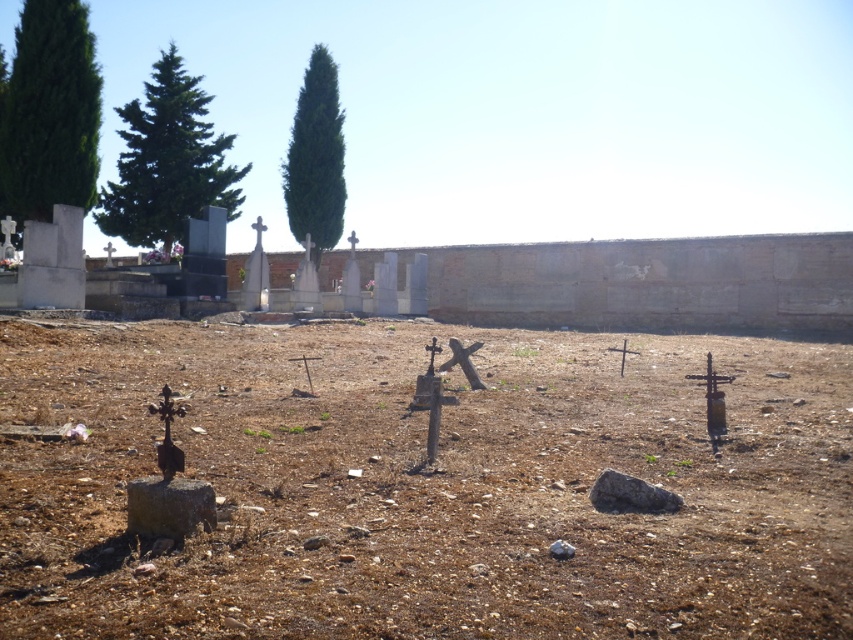
Question: Considering the relative positions of green leafy tree at upper left and green textured tree at center in the image provided, where is green leafy tree at upper left located with respect to green textured tree at center?

Choices:
 (A) below
 (B) above

Answer: (A)

Question: Does brown dirt field at center lie behind green textured tree at center?

Choices:
 (A) yes
 (B) no

Answer: (B)

Question: Which point appears farthest from the camera in this image?

Choices:
 (A) (117, 228)
 (B) (16, 68)
 (C) (759, 458)

Answer: (A)

Question: Which point is closer to the camera?

Choices:
 (A) (316, 173)
 (B) (297, 628)
 (C) (42, 22)

Answer: (B)

Question: Is green leafy tree at upper left closer to the viewer compared to green textured tree at upper left?

Choices:
 (A) yes
 (B) no

Answer: (A)

Question: Which point is closer to the camera?

Choices:
 (A) green textured tree at center
 (B) brown dirt field at center

Answer: (B)